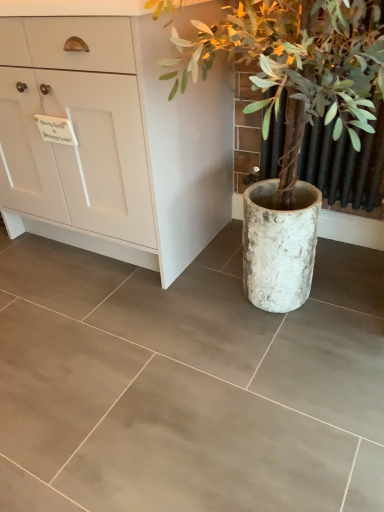
Question: Can you confirm if white matte cabinet at left is shorter than white textured pot at right?

Choices:
 (A) yes
 (B) no

Answer: (A)

Question: Is white matte cabinet at left looking in the opposite direction of white textured pot at right?

Choices:
 (A) yes
 (B) no

Answer: (B)

Question: From the image's perspective, is white matte cabinet at left on top of white textured pot at right?

Choices:
 (A) yes
 (B) no

Answer: (A)

Question: Is the depth of white matte cabinet at left greater than that of white textured pot at right?

Choices:
 (A) yes
 (B) no

Answer: (A)

Question: Considering the relative sizes of white matte cabinet at left and white textured pot at right in the image provided, is white matte cabinet at left wider than white textured pot at right?

Choices:
 (A) yes
 (B) no

Answer: (A)

Question: Is white matte cabinet at left facing towards white textured pot at right?

Choices:
 (A) no
 (B) yes

Answer: (A)

Question: Is white textured pot at right at the right side of white matte cabinet at left?

Choices:
 (A) no
 (B) yes

Answer: (B)

Question: From a real-world perspective, is white textured pot at right on top of white matte cabinet at left?

Choices:
 (A) no
 (B) yes

Answer: (B)

Question: Does white textured pot at right have a lesser width compared to white matte cabinet at left?

Choices:
 (A) no
 (B) yes

Answer: (B)

Question: Is white matte cabinet at left completely or partially inside white textured pot at right?

Choices:
 (A) no
 (B) yes

Answer: (A)

Question: Considering the relative sizes of white textured pot at right and white matte cabinet at left in the image provided, is white textured pot at right smaller than white matte cabinet at left?

Choices:
 (A) no
 (B) yes

Answer: (B)

Question: Could you tell me if white textured pot at right is turned towards white matte cabinet at left?

Choices:
 (A) yes
 (B) no

Answer: (B)

Question: From a real-world perspective, is white matte cabinet at left positioned above or below white textured pot at right?

Choices:
 (A) above
 (B) below

Answer: (B)